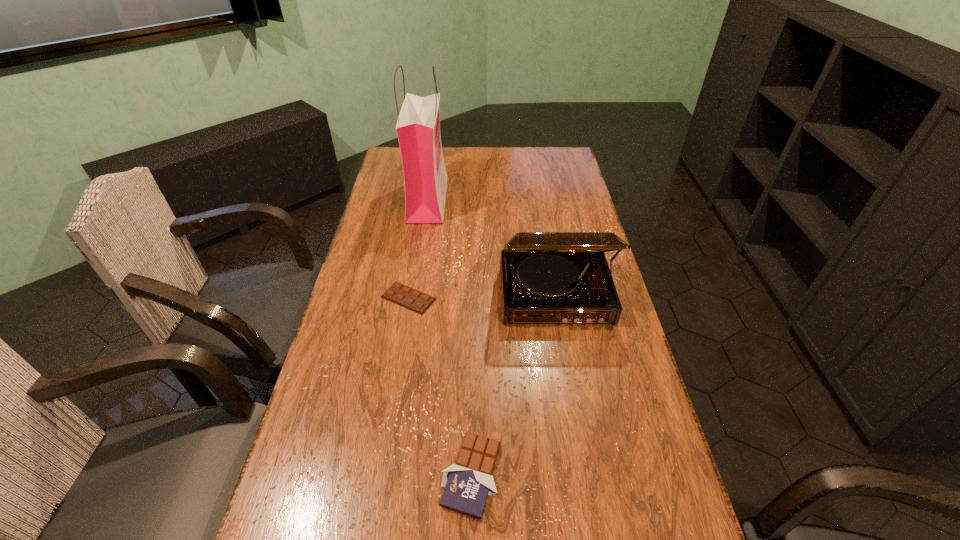
Identify the location of vacant region located on the right of the taller chocolate bar. (572, 475).

Find the location of a particular element. This screenshot has width=960, height=540. free space located 0.100m on the left of the shorter chocolate bar is located at coordinates (348, 298).

Locate an element on the screen. The width and height of the screenshot is (960, 540). shopping bag positioned at the left edge is located at coordinates (418, 127).

You are a GUI agent. You are given a task and a screenshot of the screen. Output one action in this format:
    pyautogui.click(x=<x>, y=<y>)
    Task: Click on the chocolate bar positioned at the left edge
    
    Given the screenshot: What is the action you would take?
    pyautogui.click(x=412, y=299)

I want to click on object that is at the right edge, so click(x=546, y=277).

Find the location of a particular element. The image size is (960, 540). free space at the left edge is located at coordinates (358, 274).

At what (x,y) coordinates should I click in order to perform the action: click on vacant space at the far left corner of the desktop. Please return your answer as a coordinate pair (x, y). The image size is (960, 540). Looking at the image, I should click on (390, 153).

In the image, there is a desktop. Identify the location of vacant space at the far right corner. (543, 156).

Identify the location of vacant area between the farthest object and the farther chocolate bar. The width and height of the screenshot is (960, 540). (419, 248).

The width and height of the screenshot is (960, 540). Find the location of `vacant area that lies between the tallest object and the third object from left to right`. vacant area that lies between the tallest object and the third object from left to right is located at coordinates (449, 337).